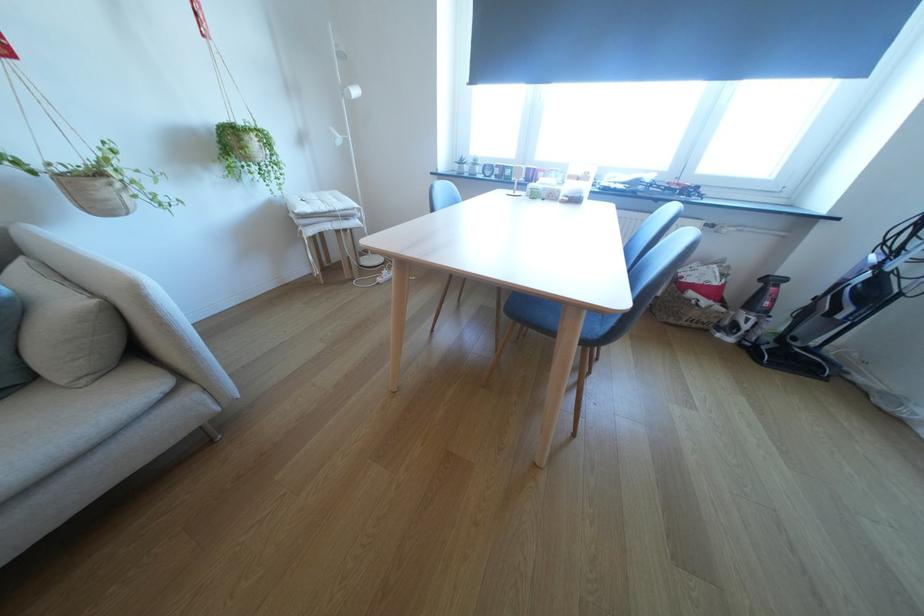
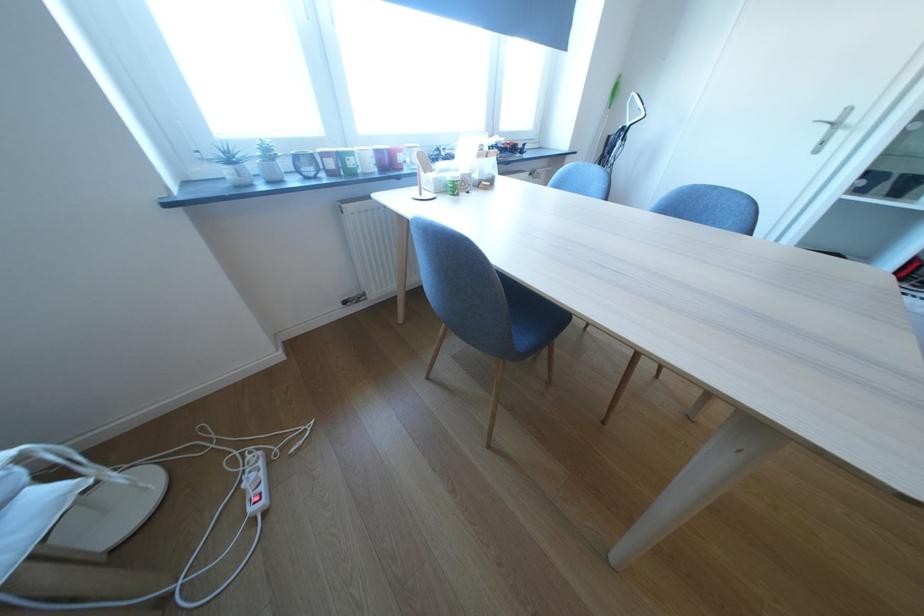
Find the pixel in the second image that matches (495,168) in the first image.

(308, 160)